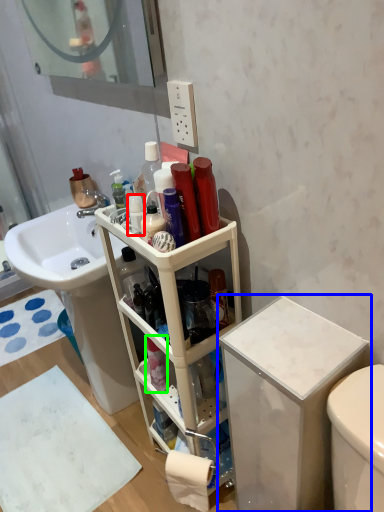
Question: Estimate the real-world distances between objects in this image. Which object is closer to toiletry (highlighted by a red box), cabinetry (highlighted by a blue box) or toiletry (highlighted by a green box)?

Choices:
 (A) cabinetry
 (B) toiletry

Answer: (A)